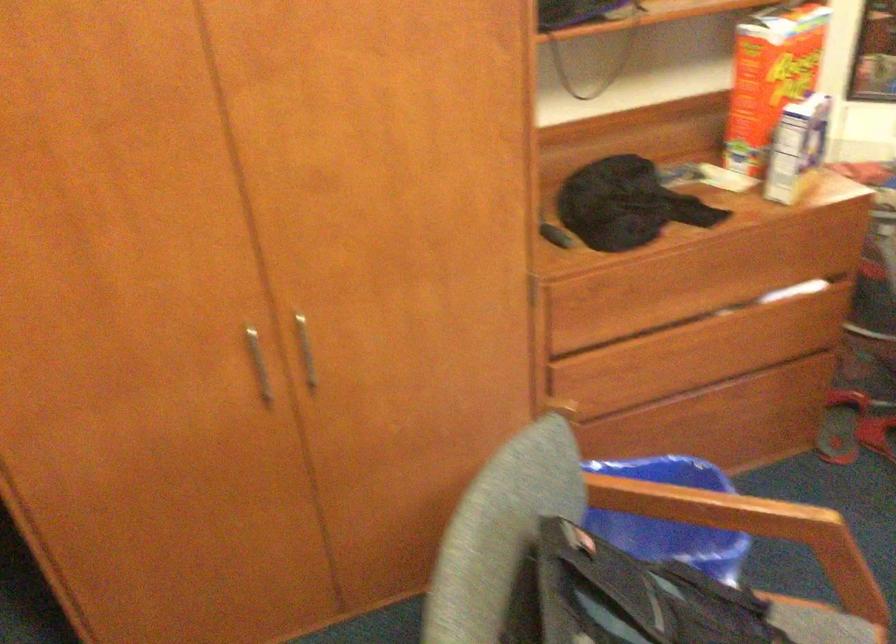
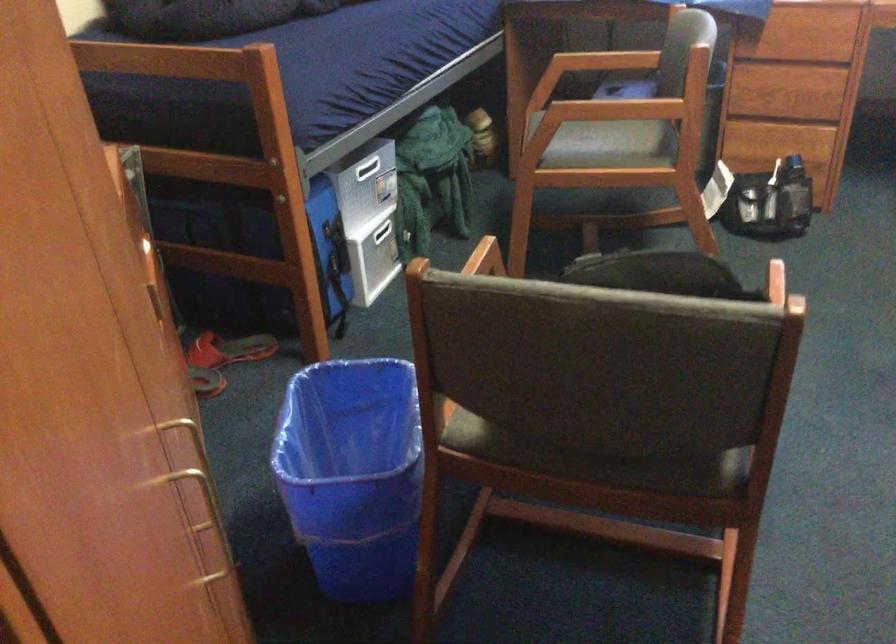
Where in the second image is the point corresponding to point 298,348 from the first image?

(188, 419)